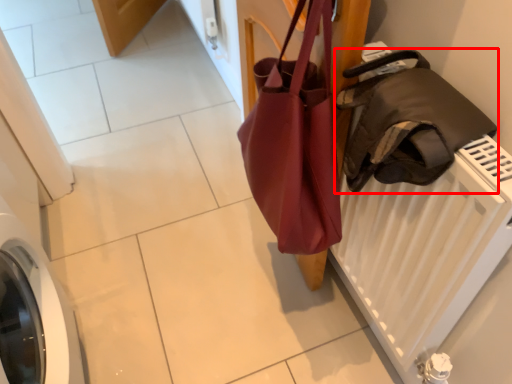
Question: From the image's perspective, what is the correct spatial positioning of luggage and bags (annotated by the red box) in reference to handbag?

Choices:
 (A) above
 (B) below

Answer: (B)